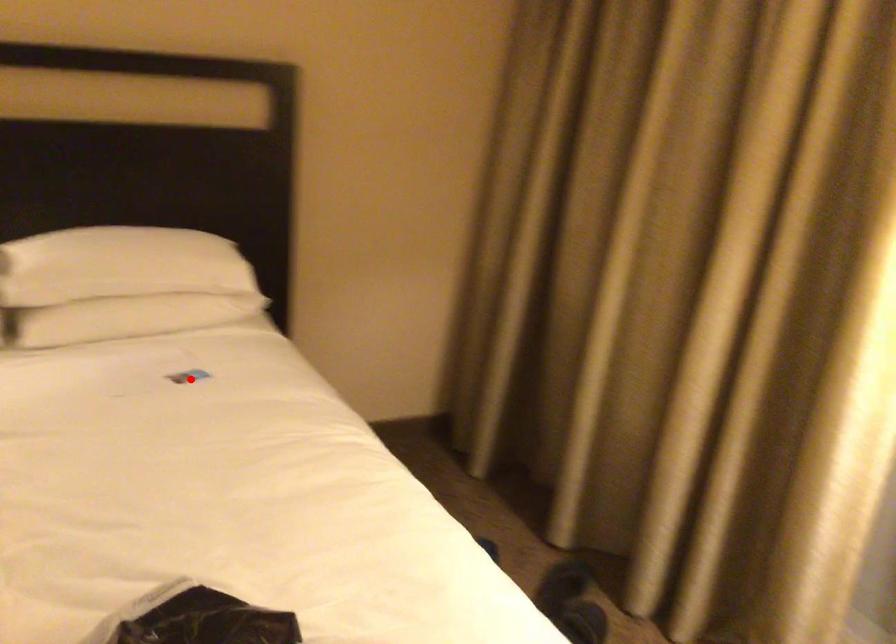
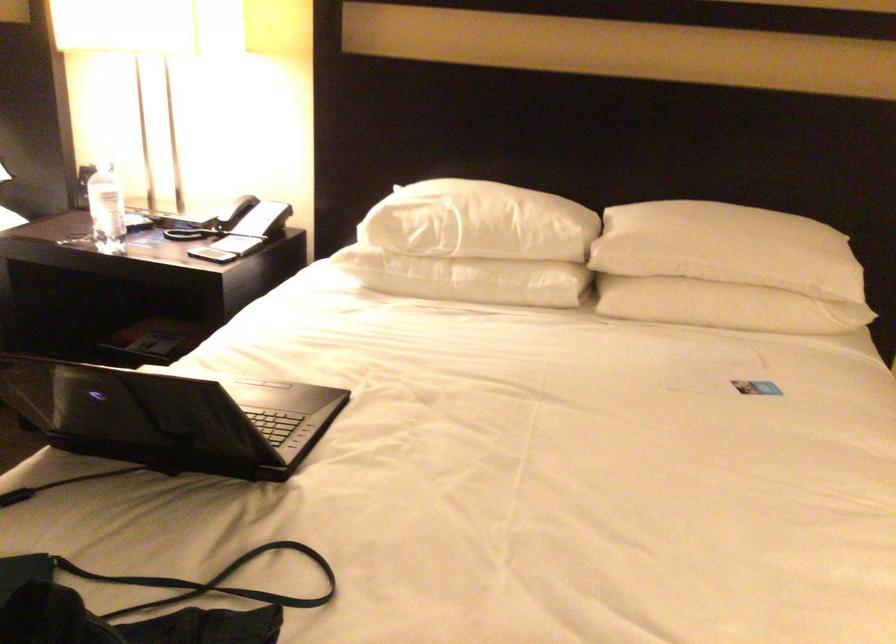
Question: I am providing you with two images of the same scene from different viewpoints. A red point is shown in image1. For the corresponding object point in image2, is it positioned nearer or farther from the camera?

Choices:
 (A) Nearer
 (B) Farther

Answer: (A)